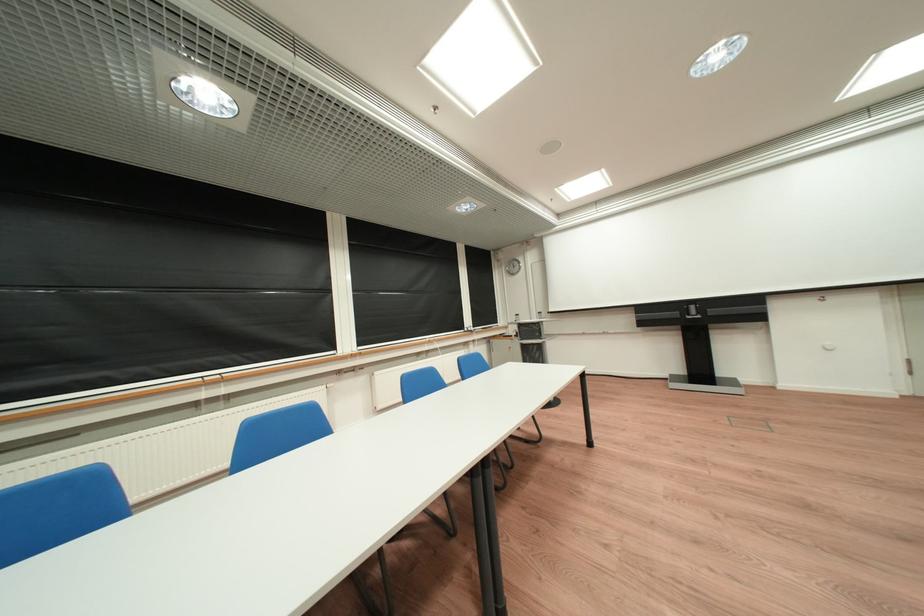
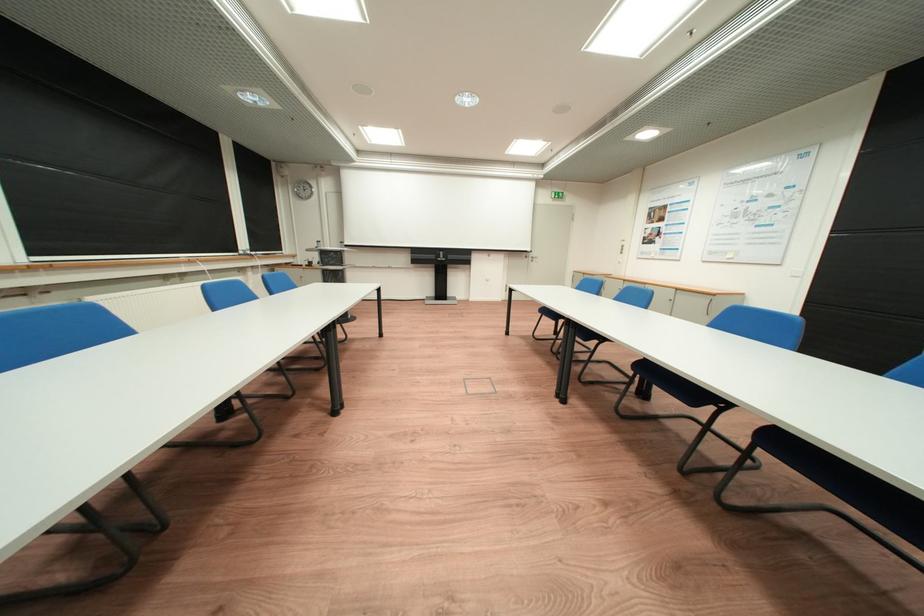
Question: The first image is from the beginning of the video and the second image is from the end. How did the camera likely rotate when shooting the video?

Choices:
 (A) Left
 (B) Right
 (C) Up
 (D) Down

Answer: (B)